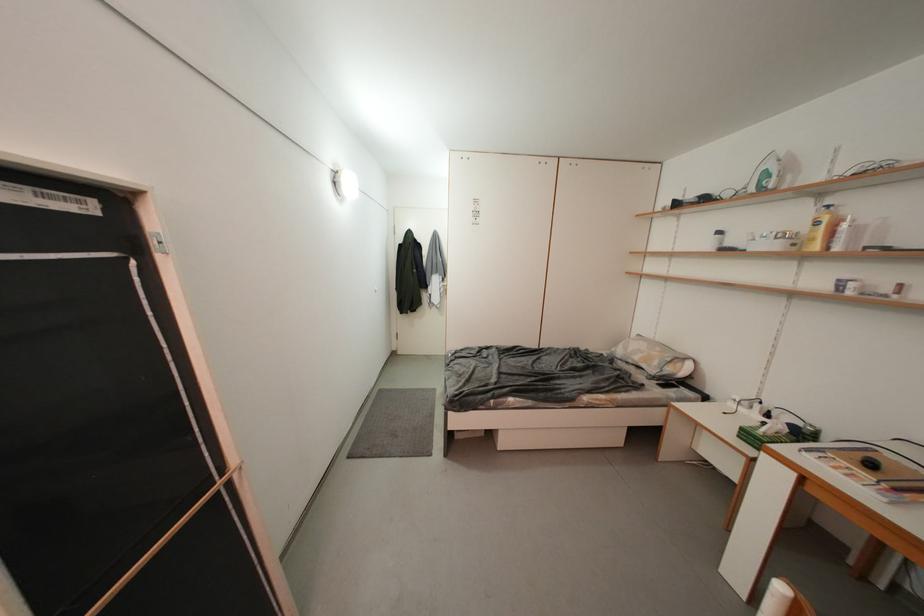
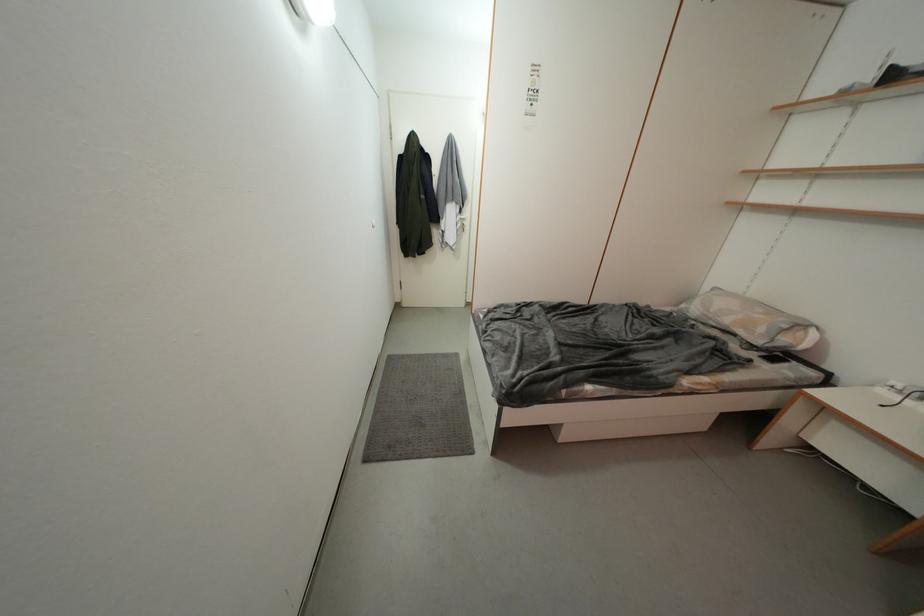
Find the pixel in the second image that matches [442,285] in the first image.

(457, 216)